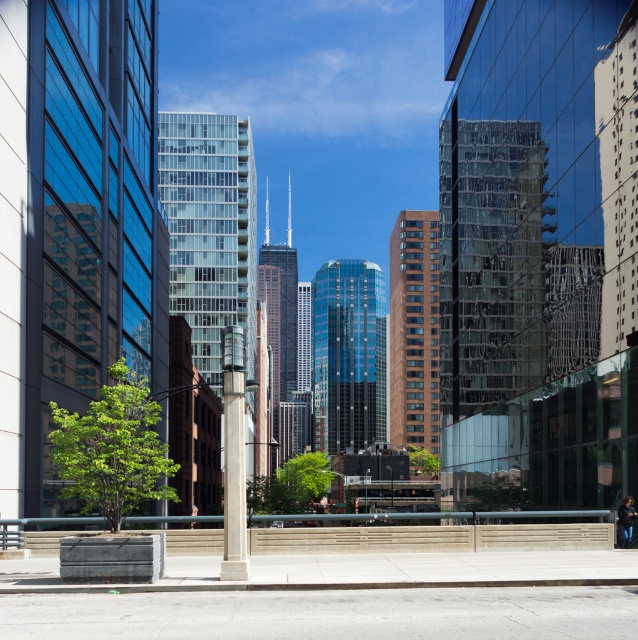
Question: Considering the real-world distances, which object is closest to the transparent glass building at center?

Choices:
 (A) glassy reflective skyscraper at left
 (B) brown brick building at center
 (C) brown glass skyscraper at center
 (D) reflective glass skyscraper at right

Answer: (D)

Question: Estimate the real-world distances between objects in this image. Which object is closer to the transparent glass building at center?

Choices:
 (A) brown brick building at center
 (B) shiny glass skyscraper at center
 (C) glassy reflective skyscraper at left

Answer: (C)

Question: Can you confirm if shiny glass skyscraper at center is thinner than brown brick building at center?

Choices:
 (A) yes
 (B) no

Answer: (B)

Question: Considering the relative positions of transparent glass building at center and brown glass skyscraper at center in the image provided, where is transparent glass building at center located with respect to brown glass skyscraper at center?

Choices:
 (A) left
 (B) right

Answer: (B)

Question: Which point is farther to the camera?

Choices:
 (A) (454, 125)
 (B) (459, 125)
 (C) (47, 164)
 (D) (260, 256)

Answer: (D)

Question: Is transparent glass building at center behind brown brick building at center?

Choices:
 (A) yes
 (B) no

Answer: (B)